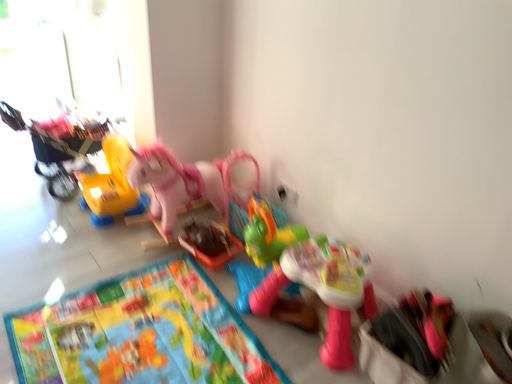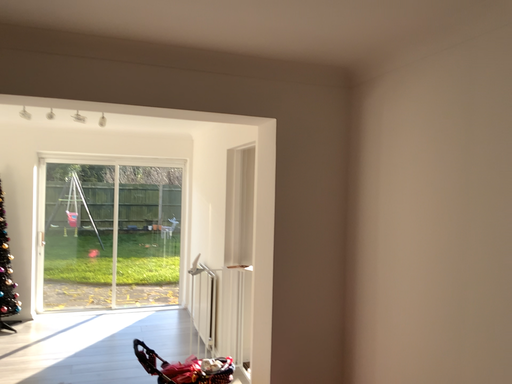
Question: How did the camera likely rotate when shooting the video?

Choices:
 (A) rotated upward
 (B) rotated downward

Answer: (A)